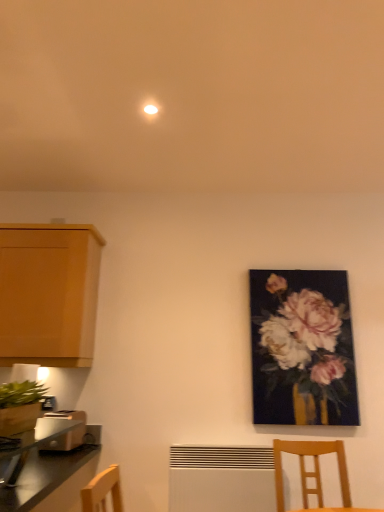
Identify the location of matte floral painting at right. Image resolution: width=384 pixels, height=512 pixels. (302, 348).

What do you see at coordinates (48, 294) in the screenshot? I see `wooden cabinet at left` at bounding box center [48, 294].

Describe the element at coordinates (313, 471) in the screenshot. The height and width of the screenshot is (512, 384). I see `wooden chair at lower right` at that location.

The height and width of the screenshot is (512, 384). Find the location of `metallic silver toaster at lower left`. metallic silver toaster at lower left is located at coordinates (53, 477).

Find the location of a particular element. matte floral painting at right is located at coordinates (302, 348).

From a real-world perspective, is white matte radiator at lower center below matte floral painting at right?

Indeed, from a real-world perspective, white matte radiator at lower center is positioned beneath matte floral painting at right.

Is white matte radiator at lower center placed right next to matte floral painting at right?

They are not placed beside each other.

Could you tell me if white matte radiator at lower center is facing matte floral painting at right?

No.

Is metallic silver toaster at lower left at the back of matte floral painting at right?

matte floral painting at right is not turned away from metallic silver toaster at lower left.

Would you say matte floral painting at right is a long distance from metallic silver toaster at lower left?

Yes, matte floral painting at right and metallic silver toaster at lower left are quite far apart.

Locate an element on the screen. countertop on the left of matte floral painting at right is located at coordinates (53, 477).

From a real-world perspective, which object rests below the other?

From a 3D spatial view, light brown plastic toaster at lower left is below.

Does point (68, 508) come farther from viewer compared to point (66, 436)?

No, (68, 508) is closer to viewer.

Is metallic silver toaster at lower left next to light brown plastic toaster at lower left and touching it?

No, metallic silver toaster at lower left is not next to light brown plastic toaster at lower left.

Is the position of white matte radiator at lower center more distant than that of metallic silver toaster at lower left?

Yes, white matte radiator at lower center is further from the camera.

Visually, is white matte radiator at lower center positioned to the left or to the right of metallic silver toaster at lower left?

From the image, it's evident that white matte radiator at lower center is to the right of metallic silver toaster at lower left.

Consider the image. Is metallic silver toaster at lower left a part of white matte radiator at lower center?

No, metallic silver toaster at lower left is not a part of white matte radiator at lower center.

Does white matte radiator at lower center have a larger size compared to metallic silver toaster at lower left?

No, white matte radiator at lower center is not bigger than metallic silver toaster at lower left.

Considering the points (329, 407) and (73, 435), which point is behind, point (329, 407) or point (73, 435)?

The point (329, 407) is behind.

At what (x,y) coordinates should I click in order to perform the action: click on picture frame behind the light brown plastic toaster at lower left. Please return your answer as a coordinate pair (x, y). This screenshot has height=512, width=384. Looking at the image, I should click on (302, 348).

How many degrees apart are the facing directions of matte floral painting at right and light brown plastic toaster at lower left?

The facing directions of matte floral painting at right and light brown plastic toaster at lower left are 4.92 degrees apart.

Which object is thinner, matte floral painting at right or light brown plastic toaster at lower left?

matte floral painting at right.

Can you tell me how much wooden cabinet at left and matte floral painting at right differ in facing direction?

They differ by 0.275 degrees in their facing directions.

Is wooden cabinet at left located outside matte floral painting at right?

Absolutely, wooden cabinet at left is external to matte floral painting at right.

Considering the points (80, 250) and (263, 355), which point is in front, point (80, 250) or point (263, 355)?

Point (80, 250)

Is matte floral painting at right at the back of wooden cabinet at left?

wooden cabinet at left does not have its back to matte floral painting at right.

Could you measure the distance between light brown plastic toaster at lower left and metallic silver toaster at lower left?

light brown plastic toaster at lower left is 7.77 inches away from metallic silver toaster at lower left.

From a real-world perspective, between light brown plastic toaster at lower left and metallic silver toaster at lower left, who is vertically lower?

In real-world perspective, light brown plastic toaster at lower left is lower.

Which point is more forward, (67, 423) or (69, 489)?

The point (69, 489) is more forward.

Is light brown plastic toaster at lower left facing away from metallic silver toaster at lower left?

No, light brown plastic toaster at lower left is not facing away from metallic silver toaster at lower left.

At what (x,y) coordinates should I click in order to perform the action: click on radiator on the left side of matte floral painting at right. Please return your answer as a coordinate pair (x, y). This screenshot has width=384, height=512. Looking at the image, I should click on click(x=221, y=479).

Find the location of a particular element. countertop in front of the matte floral painting at right is located at coordinates (53, 477).

Which object lies nearer to the anchor point light brown plastic toaster at lower left, wooden chair at lower right or metallic silver toaster at lower left?

Based on the image, metallic silver toaster at lower left appears to be nearer to light brown plastic toaster at lower left.

When comparing their distances from metallic silver toaster at lower left, does wooden chair at lower right or matte floral painting at right seem further?

Based on the image, matte floral painting at right appears to be further to metallic silver toaster at lower left.

Based on their spatial positions, is matte floral painting at right or white matte radiator at lower center closer to metallic silver toaster at lower left?

Among the two, white matte radiator at lower center is located nearer to metallic silver toaster at lower left.

Based on their spatial positions, is metallic silver toaster at lower left or matte floral painting at right further from white matte radiator at lower center?

metallic silver toaster at lower left is positioned further to the anchor white matte radiator at lower center.

Which object lies further to the anchor point white matte radiator at lower center, matte floral painting at right or wooden cabinet at left?

The object further to white matte radiator at lower center is wooden cabinet at left.

Which object lies further to the anchor point matte floral painting at right, metallic silver toaster at lower left or white matte radiator at lower center?

metallic silver toaster at lower left is positioned further to the anchor matte floral painting at right.

Which object lies nearer to the anchor point wooden cabinet at left, wooden chair at lower right or white matte radiator at lower center?

white matte radiator at lower center is closer to wooden cabinet at left.

Based on their spatial positions, is white matte radiator at lower center or matte floral painting at right further from metallic silver toaster at lower left?

matte floral painting at right lies further to metallic silver toaster at lower left than the other object.

At what (x,y) coordinates should I click in order to perform the action: click on toaster between metallic silver toaster at lower left and wooden cabinet at left along the z-axis. Please return your answer as a coordinate pair (x, y). The width and height of the screenshot is (384, 512). Looking at the image, I should click on click(60, 430).

Where is `radiator between metallic silver toaster at lower left and matte floral painting at right in the front-back direction`? radiator between metallic silver toaster at lower left and matte floral painting at right in the front-back direction is located at coordinates (221, 479).

You are a GUI agent. You are given a task and a screenshot of the screen. Output one action in this format:
    pyautogui.click(x=<x>, y=<y>)
    Task: Click on the toaster between wooden cabinet at left and wooden chair at lower right in the horizontal direction
    The height and width of the screenshot is (512, 384).
    Given the screenshot: What is the action you would take?
    coord(60,430)

At what (x,y) coordinates should I click in order to perform the action: click on toaster located between wooden cabinet at left and white matte radiator at lower center in the left-right direction. Please return your answer as a coordinate pair (x, y). Looking at the image, I should click on (60, 430).